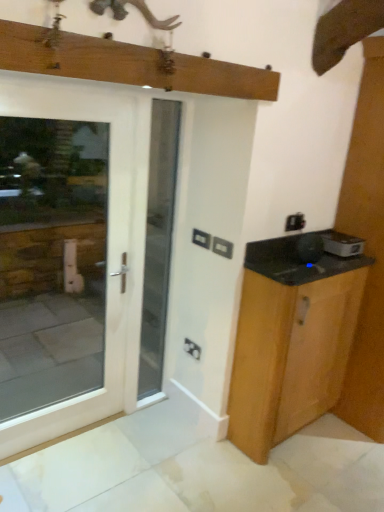
At what (x,y) coordinates should I click in order to perform the action: click on free space in front of white glossy microwave at right. Please return your answer as a coordinate pair (x, y). Image resolution: width=384 pixels, height=512 pixels. Looking at the image, I should click on click(x=342, y=264).